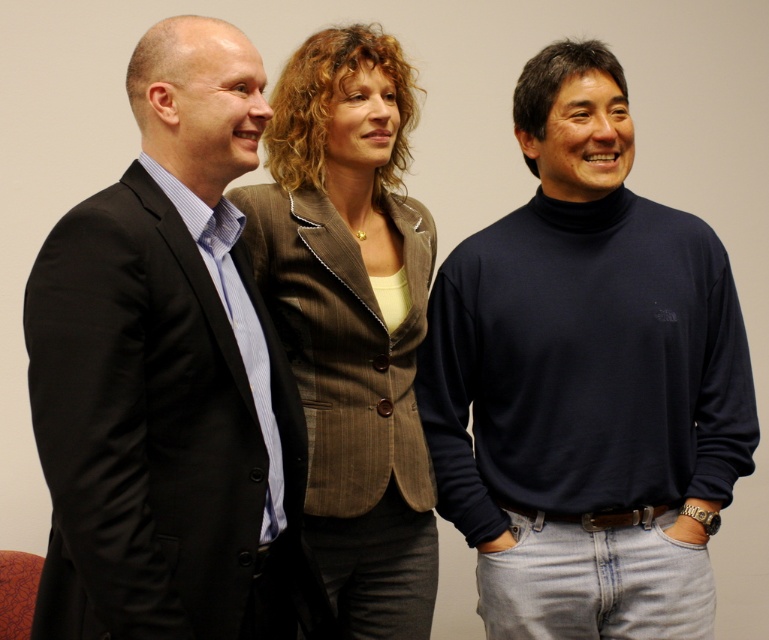
From the picture: Does navy turtleneck sweater at center have a larger size compared to brown pinstripe blazer at center?

Correct, navy turtleneck sweater at center is larger in size than brown pinstripe blazer at center.

How far apart are navy turtleneck sweater at center and brown pinstripe blazer at center?

24.40 centimeters

In order to click on navy turtleneck sweater at center in this screenshot , I will do `click(586, 380)`.

Does navy turtleneck sweater at center appear on the left side of matte black suit at left?

Incorrect, navy turtleneck sweater at center is not on the left side of matte black suit at left.

Between navy turtleneck sweater at center and matte black suit at left, which one is positioned lower?

matte black suit at left is below.

The height and width of the screenshot is (640, 769). I want to click on navy turtleneck sweater at center, so click(x=586, y=380).

Looking at this image, is matte black suit at left shorter than brown pinstripe blazer at center?

Correct, matte black suit at left is not as tall as brown pinstripe blazer at center.

Can you confirm if matte black suit at left is wider than brown pinstripe blazer at center?

Yes.

Which is behind, point (160, 129) or point (305, 252)?

Point (305, 252)

Identify the location of matte black suit at left. This screenshot has width=769, height=640. (168, 376).